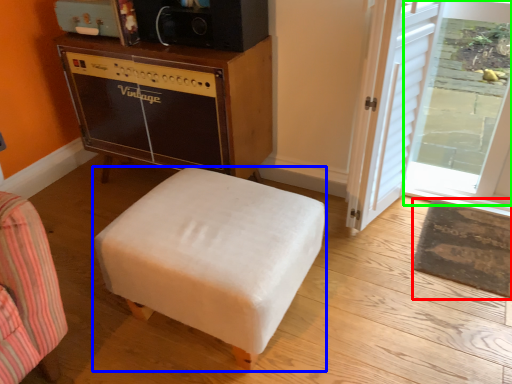
Question: Which is nearer to the mat (highlighted by a red box)? furniture (highlighted by a blue box) or glass door (highlighted by a green box).

Choices:
 (A) furniture
 (B) glass door

Answer: (B)